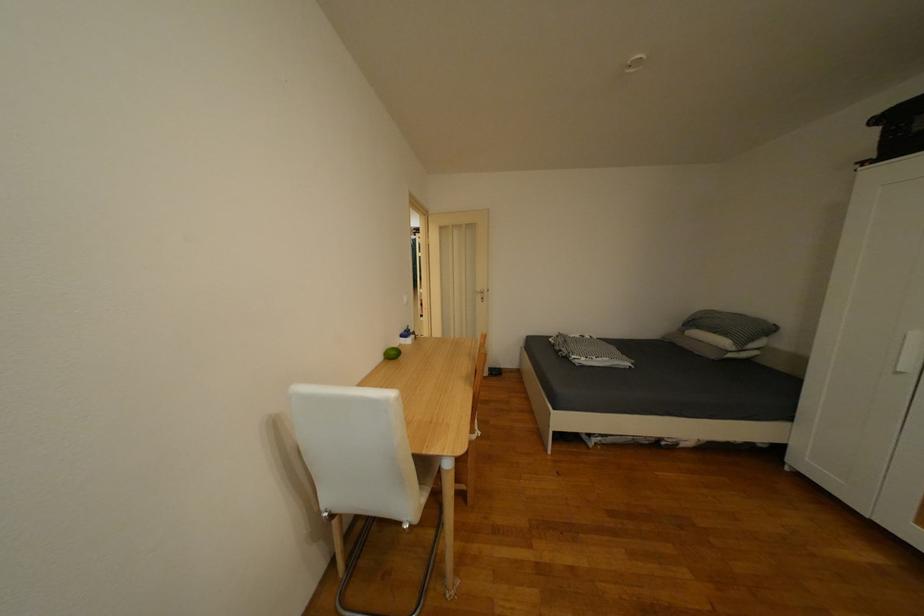
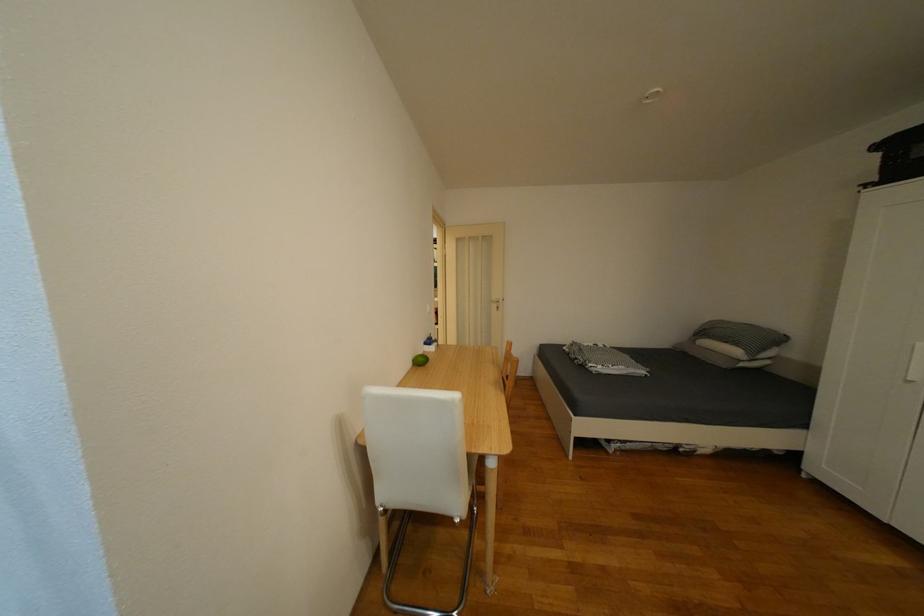
Locate, in the second image, the point that corresponds to (x=402, y=354) in the first image.

(431, 361)